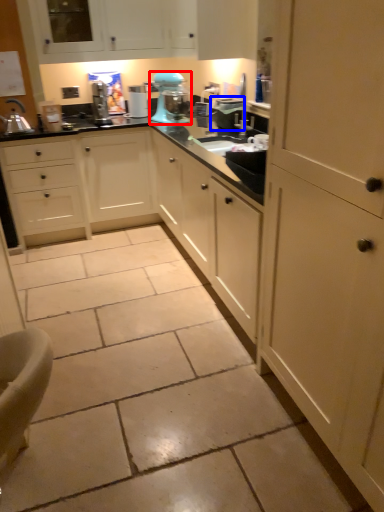
Question: Which of the following is the closest to the observer, home appliance (highlighted by a red box) or appliance (highlighted by a blue box)?

Choices:
 (A) home appliance
 (B) appliance

Answer: (B)